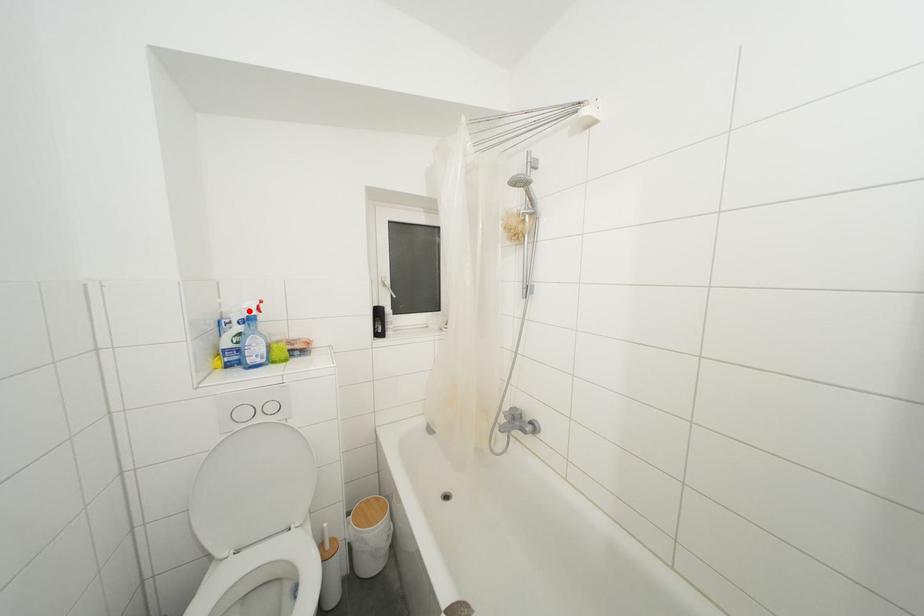
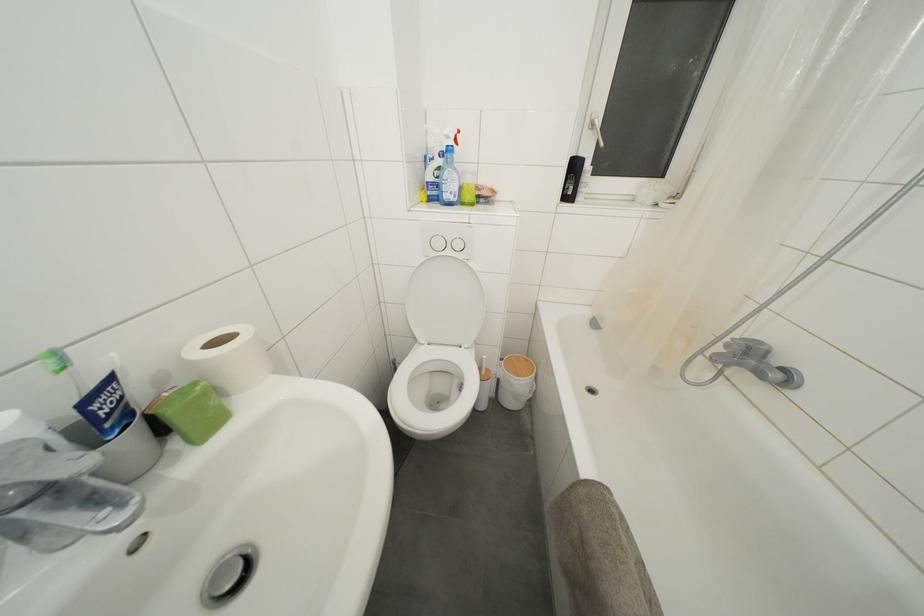
Question: I am providing you with two images of the same scene from different viewpoints. A red point is marked on the first image. At the location where the point appears in image 1, is it still visible in image 2?

Choices:
 (A) Yes
 (B) No

Answer: (A)